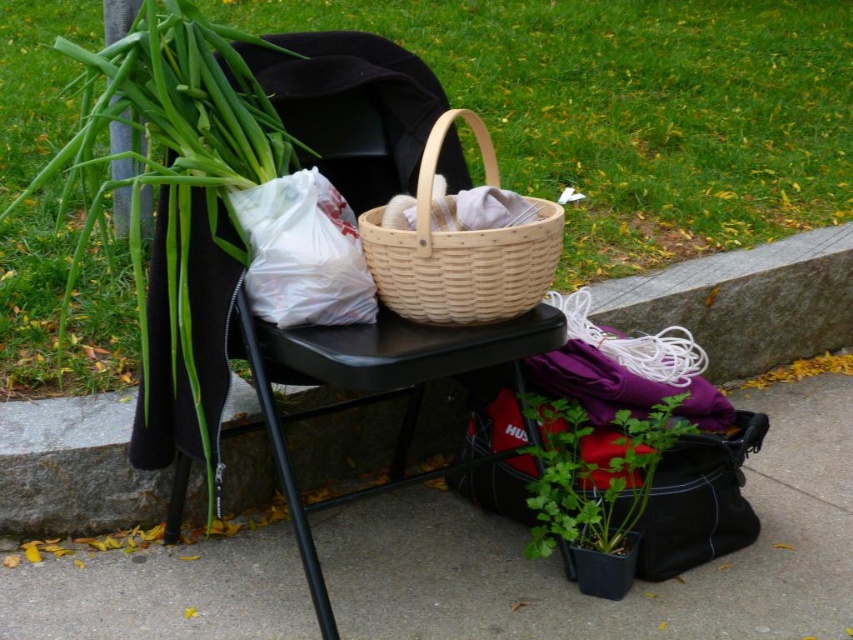
Question: Does green grass at upper center have a greater width compared to gray concrete curb at lower left?

Choices:
 (A) yes
 (B) no

Answer: (A)

Question: Is black plastic tray at lower center bigger than natural wood basket at center?

Choices:
 (A) no
 (B) yes

Answer: (B)

Question: Is the position of black plastic tray at lower center more distant than that of gray concrete curb at lower left?

Choices:
 (A) yes
 (B) no

Answer: (B)

Question: Which point is farther to the camera?

Choices:
 (A) (462, 296)
 (B) (480, 362)
 (C) (376, 536)
 (D) (283, 209)

Answer: (C)

Question: Which object is positioned closest to the gray concrete curb at lower left?

Choices:
 (A) black plastic tray at lower center
 (B) green grass at upper center
 (C) natural wood basket at center
 (D) green matte plant at left

Answer: (A)

Question: Which of the following is the closest to the observer?

Choices:
 (A) (346, 531)
 (B) (262, 193)
 (C) (463, 236)

Answer: (C)